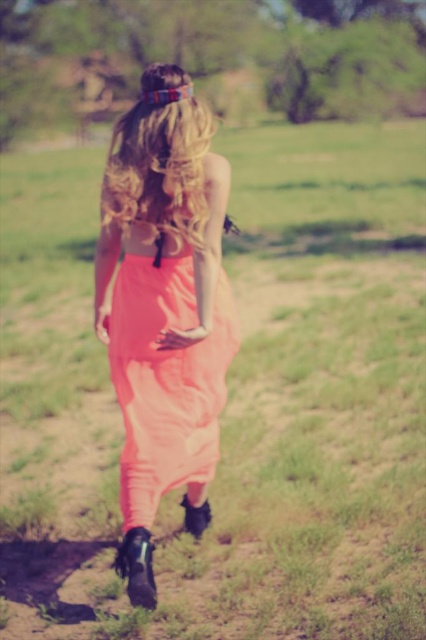
You are a photographer trying to capture the perfect shot of the coral fabric dress at center and the blonde hair at center. Since you want to highlight the dress, which object should you focus on and why?

The coral fabric dress at center has a greater height compared to the blonde hair at center, so focusing on the dress would naturally draw attention due to its larger size.

You are a photographer trying to capture the perfect shot of the coral fabric dress at center and the blonde hair at center. Since the dress is narrower than the hair, which object should you zoom in on to ensure both are fully visible in the frame?

Since the coral fabric dress at center has a lesser width compared to blonde hair at center, you should zoom in on the blonde hair at center to ensure both are fully visible in the frame.

You are a photographer trying to capture the vibrant orange jumpsuit of the person in the image. The camera is focused on the point at coordinates point (x=164, y=308). According to the scene description, where is this point located? Please answer with the object label from the Objects section.

The point (x=164, y=308) is located on the coral fabric skirt at center.